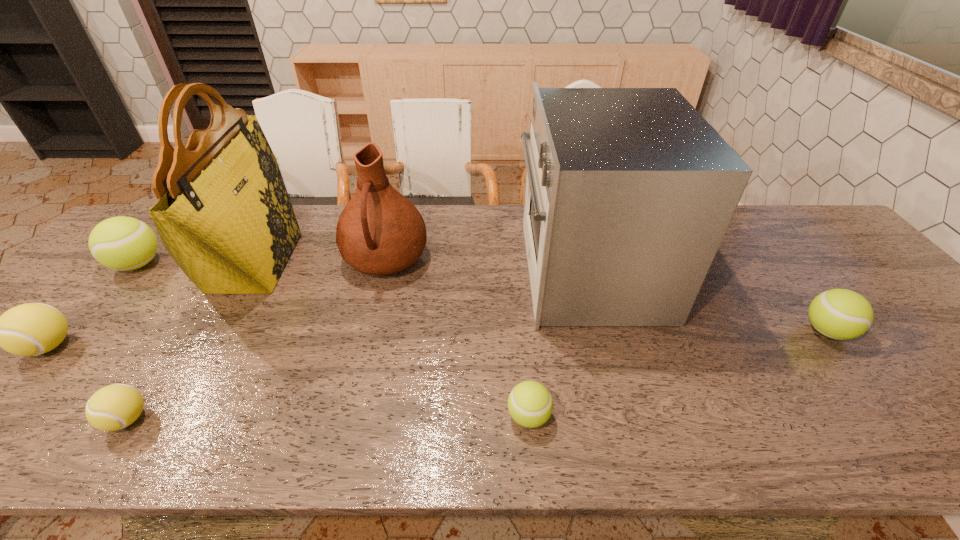
I want to click on vacant space that satisfies the following two spatial constraints: 1. on the front-facing side of the tote bag; 2. on the back side of the rightmost green tennis ball, so click(216, 331).

The height and width of the screenshot is (540, 960). Identify the location of vacant space that satisfies the following two spatial constraints: 1. on the front-facing side of the smallest green tennis ball; 2. on the left side of the yellow tote bag. (166, 416).

Locate an element on the screen. free location that satisfies the following two spatial constraints: 1. on the front panel of the toaster oven; 2. on the front side of the farther yellow tennis ball is located at coordinates 609,346.

Locate an element on the screen. The image size is (960, 540). vacant space that satisfies the following two spatial constraints: 1. on the front panel of the second biggest green tennis ball; 2. on the left side of the toaster oven is located at coordinates (605, 331).